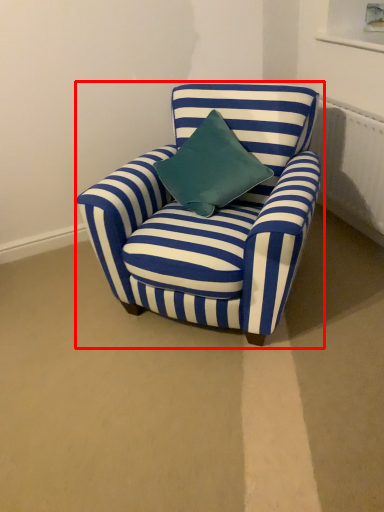
Question: Observing the image, what is the correct spatial positioning of chair (annotated by the red box) in reference to radiator?

Choices:
 (A) right
 (B) left

Answer: (B)